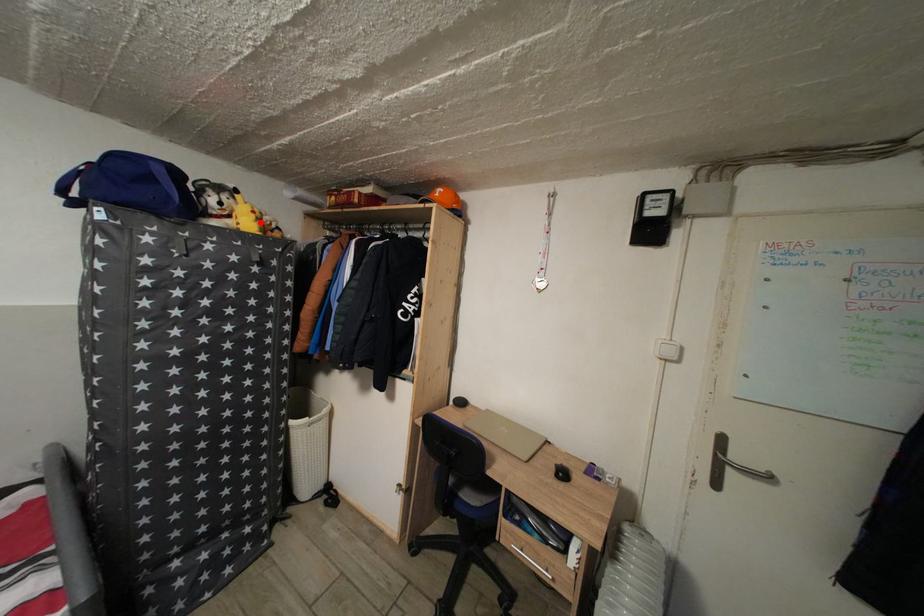
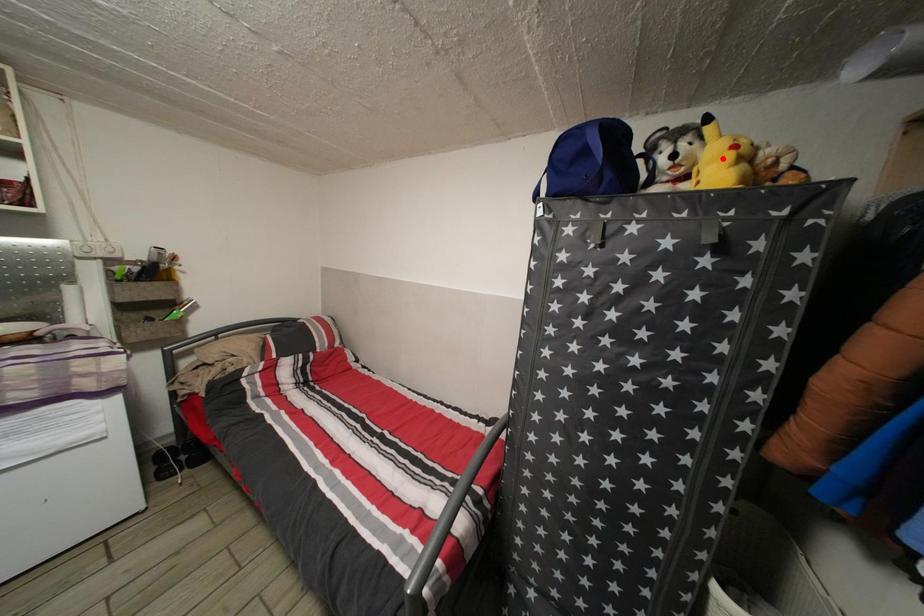
I am providing you with two images of the same scene from different viewpoints. A red point is marked on the first image and another point is marked on the second image. Are the points marked in image1 and image2 representing the same 3D position?

No